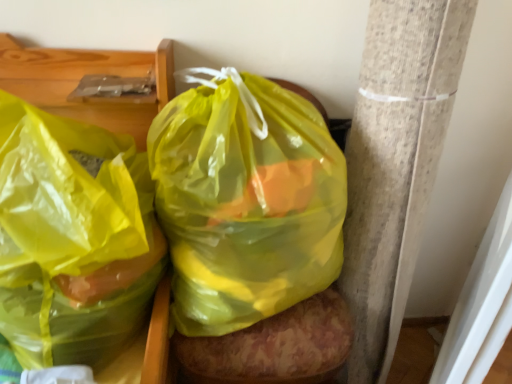
What do you see at coordinates (72, 237) in the screenshot?
I see `translucent yellow plastic bag at left, which is the second plastic bag from right to left` at bounding box center [72, 237].

The height and width of the screenshot is (384, 512). Find the location of `translucent yellow plastic bag at left, which is the second plastic bag from right to left`. translucent yellow plastic bag at left, which is the second plastic bag from right to left is located at coordinates [x=72, y=237].

Measure the distance between translucent yellow plastic bag at left, which is the 1th plastic bag in left-to-right order, and camera.

translucent yellow plastic bag at left, which is the 1th plastic bag in left-to-right order, is 24.52 inches away from camera.

Describe the element at coordinates (245, 200) in the screenshot. I see `translucent yellow plastic bag at center, the first plastic bag in the right-to-left sequence` at that location.

Locate an element on the screen. Image resolution: width=512 pixels, height=384 pixels. translucent yellow plastic bag at center, arranged as the 2th plastic bag when viewed from the left is located at coordinates (245, 200).

You are a GUI agent. You are given a task and a screenshot of the screen. Output one action in this format:
    pyautogui.click(x=<x>, y=<y>)
    Task: Click on the translucent yellow plastic bag at left, which is the 1th plastic bag in left-to-right order
    The width and height of the screenshot is (512, 384).
    Given the screenshot: What is the action you would take?
    pyautogui.click(x=72, y=237)

Which object is positioned more to the left, translucent yellow plastic bag at center, the first plastic bag in the right-to-left sequence, or translucent yellow plastic bag at left, which is the second plastic bag from right to left?

From the viewer's perspective, translucent yellow plastic bag at left, which is the second plastic bag from right to left, appears more on the left side.

Relative to translucent yellow plastic bag at left, which is the second plastic bag from right to left, is translucent yellow plastic bag at center, the first plastic bag in the right-to-left sequence, in front or behind?

In the image, translucent yellow plastic bag at center, the first plastic bag in the right-to-left sequence, appears behind translucent yellow plastic bag at left, which is the second plastic bag from right to left.

Considering the positions of points (247, 148) and (97, 233), is point (247, 148) closer to camera compared to point (97, 233)?

That is False.

From the image's perspective, which one is positioned lower, translucent yellow plastic bag at center, the first plastic bag in the right-to-left sequence, or translucent yellow plastic bag at left, which is the 1th plastic bag in left-to-right order?

translucent yellow plastic bag at left, which is the 1th plastic bag in left-to-right order, from the image's perspective.

From a real-world perspective, between translucent yellow plastic bag at center, the first plastic bag in the right-to-left sequence, and translucent yellow plastic bag at left, which is the second plastic bag from right to left, who is vertically lower?

translucent yellow plastic bag at left, which is the second plastic bag from right to left.

Does translucent yellow plastic bag at center, arranged as the 2th plastic bag when viewed from the left, have a greater width compared to translucent yellow plastic bag at left, which is the second plastic bag from right to left?

No, translucent yellow plastic bag at center, arranged as the 2th plastic bag when viewed from the left, is not wider than translucent yellow plastic bag at left, which is the second plastic bag from right to left.

Consider the image. Can you confirm if translucent yellow plastic bag at center, arranged as the 2th plastic bag when viewed from the left, is shorter than translucent yellow plastic bag at left, which is the 1th plastic bag in left-to-right order?

Incorrect, the height of translucent yellow plastic bag at center, arranged as the 2th plastic bag when viewed from the left, does not fall short of that of translucent yellow plastic bag at left, which is the 1th plastic bag in left-to-right order.

Which of these two, translucent yellow plastic bag at center, arranged as the 2th plastic bag when viewed from the left, or translucent yellow plastic bag at left, which is the 1th plastic bag in left-to-right order, is bigger?

With larger size is translucent yellow plastic bag at left, which is the 1th plastic bag in left-to-right order.

Is translucent yellow plastic bag at center, arranged as the 2th plastic bag when viewed from the left, completely or partially outside of translucent yellow plastic bag at left, which is the second plastic bag from right to left?

Absolutely, translucent yellow plastic bag at center, arranged as the 2th plastic bag when viewed from the left, is external to translucent yellow plastic bag at left, which is the second plastic bag from right to left.

Is there a large distance between translucent yellow plastic bag at center, the first plastic bag in the right-to-left sequence, and translucent yellow plastic bag at left, which is the second plastic bag from right to left?

No, there isn't a large distance between translucent yellow plastic bag at center, the first plastic bag in the right-to-left sequence, and translucent yellow plastic bag at left, which is the second plastic bag from right to left.

Is translucent yellow plastic bag at center, the first plastic bag in the right-to-left sequence, looking in the opposite direction of translucent yellow plastic bag at left, which is the 1th plastic bag in left-to-right order?

translucent yellow plastic bag at center, the first plastic bag in the right-to-left sequence, does not have its back to translucent yellow plastic bag at left, which is the 1th plastic bag in left-to-right order.

Measure the distance from translucent yellow plastic bag at center, arranged as the 2th plastic bag when viewed from the left, to translucent yellow plastic bag at left, which is the 1th plastic bag in left-to-right order.

translucent yellow plastic bag at center, arranged as the 2th plastic bag when viewed from the left, and translucent yellow plastic bag at left, which is the 1th plastic bag in left-to-right order, are 7.20 inches apart from each other.

Where is `plastic bag above the translucent yellow plastic bag at left, which is the 1th plastic bag in left-to-right order (from a real-world perspective)`? plastic bag above the translucent yellow plastic bag at left, which is the 1th plastic bag in left-to-right order (from a real-world perspective) is located at coordinates (245, 200).

Is translucent yellow plastic bag at left, which is the 1th plastic bag in left-to-right order, at the left side of translucent yellow plastic bag at center, arranged as the 2th plastic bag when viewed from the left?

Indeed, translucent yellow plastic bag at left, which is the 1th plastic bag in left-to-right order, is positioned on the left side of translucent yellow plastic bag at center, arranged as the 2th plastic bag when viewed from the left.

Which is behind, translucent yellow plastic bag at left, which is the 1th plastic bag in left-to-right order, or translucent yellow plastic bag at center, the first plastic bag in the right-to-left sequence?

translucent yellow plastic bag at center, the first plastic bag in the right-to-left sequence, is further away from the camera.

Does point (56, 262) lie in front of point (190, 313)?

That is True.

From the image's perspective, which is above, translucent yellow plastic bag at left, which is the second plastic bag from right to left, or translucent yellow plastic bag at center, arranged as the 2th plastic bag when viewed from the left?

translucent yellow plastic bag at center, arranged as the 2th plastic bag when viewed from the left.

From a real-world perspective, which object stands above the other?

translucent yellow plastic bag at center, the first plastic bag in the right-to-left sequence.

Can you confirm if translucent yellow plastic bag at left, which is the 1th plastic bag in left-to-right order, is wider than translucent yellow plastic bag at center, the first plastic bag in the right-to-left sequence?

Indeed, translucent yellow plastic bag at left, which is the 1th plastic bag in left-to-right order, has a greater width compared to translucent yellow plastic bag at center, the first plastic bag in the right-to-left sequence.

Which of these two, translucent yellow plastic bag at left, which is the second plastic bag from right to left, or translucent yellow plastic bag at center, the first plastic bag in the right-to-left sequence, stands taller?

translucent yellow plastic bag at center, the first plastic bag in the right-to-left sequence.

Considering the sizes of objects translucent yellow plastic bag at left, which is the 1th plastic bag in left-to-right order, and translucent yellow plastic bag at center, the first plastic bag in the right-to-left sequence, in the image provided, who is smaller, translucent yellow plastic bag at left, which is the 1th plastic bag in left-to-right order, or translucent yellow plastic bag at center, the first plastic bag in the right-to-left sequence,?

translucent yellow plastic bag at center, the first plastic bag in the right-to-left sequence.

Is translucent yellow plastic bag at left, which is the second plastic bag from right to left, not inside translucent yellow plastic bag at center, arranged as the 2th plastic bag when viewed from the left?

Yes, translucent yellow plastic bag at left, which is the second plastic bag from right to left, is not within translucent yellow plastic bag at center, arranged as the 2th plastic bag when viewed from the left.

Based on the photo, is the surface of translucent yellow plastic bag at left, which is the second plastic bag from right to left, in direct contact with translucent yellow plastic bag at center, arranged as the 2th plastic bag when viewed from the left?

No, translucent yellow plastic bag at left, which is the second plastic bag from right to left, is not next to translucent yellow plastic bag at center, arranged as the 2th plastic bag when viewed from the left.

Is translucent yellow plastic bag at left, which is the second plastic bag from right to left, looking in the opposite direction of translucent yellow plastic bag at center, arranged as the 2th plastic bag when viewed from the left?

Yes, translucent yellow plastic bag at left, which is the second plastic bag from right to left, is facing away from translucent yellow plastic bag at center, arranged as the 2th plastic bag when viewed from the left.

What's the angular difference between translucent yellow plastic bag at left, which is the 1th plastic bag in left-to-right order, and translucent yellow plastic bag at center, the first plastic bag in the right-to-left sequence,'s facing directions?

There is a 76.1-degree angle between the facing directions of translucent yellow plastic bag at left, which is the 1th plastic bag in left-to-right order, and translucent yellow plastic bag at center, the first plastic bag in the right-to-left sequence.

How distant is translucent yellow plastic bag at left, which is the second plastic bag from right to left, from translucent yellow plastic bag at center, arranged as the 2th plastic bag when viewed from the left?

7.20 inches.

You are a GUI agent. You are given a task and a screenshot of the screen. Output one action in this format:
    pyautogui.click(x=<x>, y=<y>)
    Task: Click on the plastic bag on the left side of translucent yellow plastic bag at center, arranged as the 2th plastic bag when viewed from the left
    The height and width of the screenshot is (384, 512).
    Given the screenshot: What is the action you would take?
    pyautogui.click(x=72, y=237)

This screenshot has height=384, width=512. In order to click on plastic bag behind the translucent yellow plastic bag at left, which is the 1th plastic bag in left-to-right order in this screenshot , I will do `click(245, 200)`.

In order to click on plastic bag below the translucent yellow plastic bag at center, the first plastic bag in the right-to-left sequence (from a real-world perspective) in this screenshot , I will do `click(72, 237)`.